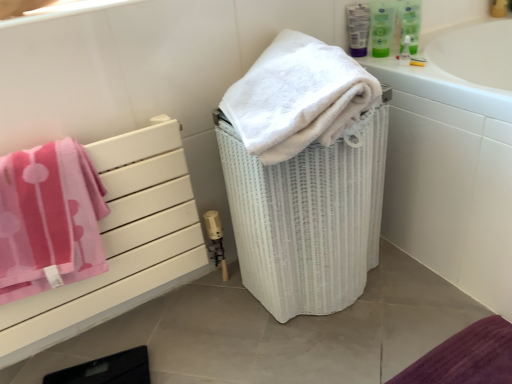
Identify the location of free space to the left of white wicker laundry basket at center. (208, 323).